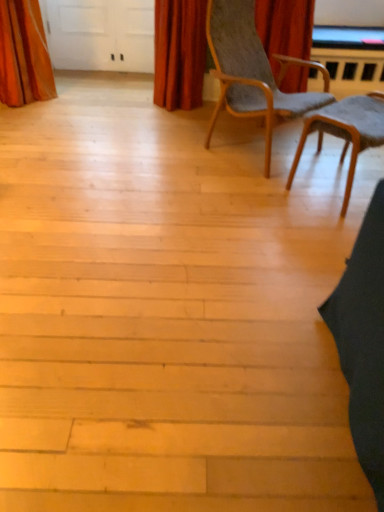
What do you see at coordinates (253, 71) in the screenshot? The width and height of the screenshot is (384, 512). I see `light brown wood chair at center, marked as the first chair in a left-to-right arrangement` at bounding box center [253, 71].

The width and height of the screenshot is (384, 512). I want to click on wooden textured chair at center right, which is the 1th chair from right to left, so click(345, 131).

The height and width of the screenshot is (512, 384). Identify the location of orange velvet curtain at upper left, which appears as the 1th curtain when viewed from the left. (24, 54).

What do you see at coordinates (179, 53) in the screenshot? The width and height of the screenshot is (384, 512). I see `velvet red curtain at upper center, the 1th curtain when ordered from right to left` at bounding box center [179, 53].

Identify the location of light brown wood chair at center, marked as the first chair in a left-to-right arrangement. (253, 71).

Looking at this image, does velvet red curtain at upper center, the 1th curtain when ordered from right to left, have a greater height compared to wooden textured chair at center right, which is the 1th chair from right to left?

Correct, velvet red curtain at upper center, the 1th curtain when ordered from right to left, is much taller as wooden textured chair at center right, which is the 1th chair from right to left.

From the image's perspective, is velvet red curtain at upper center, the 2th curtain from the left, located above or below wooden textured chair at center right, which is the 1th chair from right to left?

Clearly, from the image's perspective, velvet red curtain at upper center, the 2th curtain from the left, is above wooden textured chair at center right, which is the 1th chair from right to left.

Is velvet red curtain at upper center, the 1th curtain when ordered from right to left, placed right next to wooden textured chair at center right, which is the 1th chair from right to left?

No, velvet red curtain at upper center, the 1th curtain when ordered from right to left, is not with wooden textured chair at center right, which is the 1th chair from right to left.

Is the depth of wooden textured chair at center right, which is the 1th chair from right to left, greater than that of velvet red curtain at upper center, the 2th curtain from the left?

No, the depth of wooden textured chair at center right, which is the 1th chair from right to left, is less than that of velvet red curtain at upper center, the 2th curtain from the left.

Is point (320, 130) more distant than point (201, 10)?

No, it is in front of (201, 10).

From the image's perspective, is wooden textured chair at center right, the second chair from the left, positioned above or below velvet red curtain at upper center, the 2th curtain from the left?

From the image's perspective, wooden textured chair at center right, the second chair from the left, appears below velvet red curtain at upper center, the 2th curtain from the left.

Does orange velvet curtain at upper left, which appears as the 1th curtain when viewed from the left, appear on the right side of light brown wood chair at center, the 2th chair positioned from the right?

No.

Between orange velvet curtain at upper left, the 2th curtain in the right-to-left sequence, and light brown wood chair at center, the 2th chair positioned from the right, which one has less height?

Standing shorter between the two is orange velvet curtain at upper left, the 2th curtain in the right-to-left sequence.

Considering the relative positions of orange velvet curtain at upper left, which appears as the 1th curtain when viewed from the left, and light brown wood chair at center, the 2th chair positioned from the right, in the image provided, is orange velvet curtain at upper left, which appears as the 1th curtain when viewed from the left, behind light brown wood chair at center, the 2th chair positioned from the right,?

Yes.

This screenshot has width=384, height=512. I want to click on chair that is the 1st object to the right of the orange velvet curtain at upper left, the 2th curtain in the right-to-left sequence, starting at the anchor, so click(253, 71).

Is light brown wood chair at center, the 2th chair positioned from the right, to the right of orange velvet curtain at upper left, the 2th curtain in the right-to-left sequence, from the viewer's perspective?

Yes, light brown wood chair at center, the 2th chair positioned from the right, is to the right of orange velvet curtain at upper left, the 2th curtain in the right-to-left sequence.

Who is taller, light brown wood chair at center, the 2th chair positioned from the right, or orange velvet curtain at upper left, which appears as the 1th curtain when viewed from the left?

With more height is light brown wood chair at center, the 2th chair positioned from the right.

The height and width of the screenshot is (512, 384). There is a light brown wood chair at center, marked as the first chair in a left-to-right arrangement. What are the coordinates of `the 2nd curtain below it (from a real-world perspective)` in the screenshot? It's located at (24, 54).

Relative to orange velvet curtain at upper left, which appears as the 1th curtain when viewed from the left, is light brown wood chair at center, the 2th chair positioned from the right, in front or behind?

Clearly, light brown wood chair at center, the 2th chair positioned from the right, is in front of orange velvet curtain at upper left, which appears as the 1th curtain when viewed from the left.

Relative to wooden textured chair at center right, which is the 1th chair from right to left, is orange velvet curtain at upper left, which appears as the 1th curtain when viewed from the left, in front or behind?

In the image, orange velvet curtain at upper left, which appears as the 1th curtain when viewed from the left, appears behind wooden textured chair at center right, which is the 1th chair from right to left.

Looking at this image, from the image's perspective, which one is positioned lower, orange velvet curtain at upper left, the 2th curtain in the right-to-left sequence, or wooden textured chair at center right, which is the 1th chair from right to left?

wooden textured chair at center right, which is the 1th chair from right to left, appears lower in the image.

Is point (1, 30) positioned before point (330, 121)?

No, it is behind (330, 121).

Can you confirm if orange velvet curtain at upper left, the 2th curtain in the right-to-left sequence, is shorter than wooden textured chair at center right, which is the 1th chair from right to left?

No.

Does velvet red curtain at upper center, the 2th curtain from the left, turn towards light brown wood chair at center, the 2th chair positioned from the right?

No.

Where is `the 2nd curtain behind the light brown wood chair at center, marked as the first chair in a left-to-right arrangement`? The image size is (384, 512). the 2nd curtain behind the light brown wood chair at center, marked as the first chair in a left-to-right arrangement is located at coordinates (179, 53).

Would you say velvet red curtain at upper center, the 1th curtain when ordered from right to left, is inside or outside light brown wood chair at center, marked as the first chair in a left-to-right arrangement?

Result: The correct answer is: outside.

From a real-world perspective, which object rests below the other?

orange velvet curtain at upper left, the 2th curtain in the right-to-left sequence.

Which is more distant, (196, 76) or (29, 69)?

Point (196, 76)

Is velvet red curtain at upper center, the 1th curtain when ordered from right to left, to the left or to the right of orange velvet curtain at upper left, the 2th curtain in the right-to-left sequence, in the image?

In the image, velvet red curtain at upper center, the 1th curtain when ordered from right to left, appears on the right side of orange velvet curtain at upper left, the 2th curtain in the right-to-left sequence.

Is velvet red curtain at upper center, the 1th curtain when ordered from right to left, in front of or behind orange velvet curtain at upper left, which appears as the 1th curtain when viewed from the left, in the image?

velvet red curtain at upper center, the 1th curtain when ordered from right to left, is positioned farther from the viewer than orange velvet curtain at upper left, which appears as the 1th curtain when viewed from the left.

There is a wooden textured chair at center right, which is the 1th chair from right to left. Where is `the 2nd curtain above it (from a real-world perspective)`? This screenshot has height=512, width=384. the 2nd curtain above it (from a real-world perspective) is located at coordinates (179, 53).

This screenshot has width=384, height=512. In order to click on the 2nd curtain behind the wooden textured chair at center right, which is the 1th chair from right to left in this screenshot , I will do `click(179, 53)`.

Estimate the real-world distances between objects in this image. Which object is closer to light brown wood chair at center, the 2th chair positioned from the right, velvet red curtain at upper center, the 1th curtain when ordered from right to left, or orange velvet curtain at upper left, the 2th curtain in the right-to-left sequence?

velvet red curtain at upper center, the 1th curtain when ordered from right to left.

Looking at this image, looking at the image, which one is located closer to wooden textured chair at center right, which is the 1th chair from right to left, light brown wood chair at center, marked as the first chair in a left-to-right arrangement, or velvet red curtain at upper center, the 2th curtain from the left?

light brown wood chair at center, marked as the first chair in a left-to-right arrangement, is closer to wooden textured chair at center right, which is the 1th chair from right to left.

When comparing their distances from light brown wood chair at center, marked as the first chair in a left-to-right arrangement, does wooden textured chair at center right, the second chair from the left, or orange velvet curtain at upper left, which appears as the 1th curtain when viewed from the left, seem closer?

wooden textured chair at center right, the second chair from the left, is positioned closer to the anchor light brown wood chair at center, marked as the first chair in a left-to-right arrangement.

Which object lies further to the anchor point orange velvet curtain at upper left, which appears as the 1th curtain when viewed from the left, wooden textured chair at center right, the second chair from the left, or velvet red curtain at upper center, the 1th curtain when ordered from right to left?

Based on the image, wooden textured chair at center right, the second chair from the left, appears to be further to orange velvet curtain at upper left, which appears as the 1th curtain when viewed from the left.

From the picture: When comparing their distances from light brown wood chair at center, marked as the first chair in a left-to-right arrangement, does velvet red curtain at upper center, the 2th curtain from the left, or wooden textured chair at center right, the second chair from the left, seem closer?

The object closer to light brown wood chair at center, marked as the first chair in a left-to-right arrangement, is wooden textured chair at center right, the second chair from the left.

Based on their spatial positions, is velvet red curtain at upper center, the 2th curtain from the left, or orange velvet curtain at upper left, which appears as the 1th curtain when viewed from the left, further from wooden textured chair at center right, the second chair from the left?

orange velvet curtain at upper left, which appears as the 1th curtain when viewed from the left, is further to wooden textured chair at center right, the second chair from the left.

Estimate the real-world distances between objects in this image. Which object is closer to light brown wood chair at center, marked as the first chair in a left-to-right arrangement, wooden textured chair at center right, which is the 1th chair from right to left, or velvet red curtain at upper center, the 1th curtain when ordered from right to left?

Based on the image, wooden textured chair at center right, which is the 1th chair from right to left, appears to be nearer to light brown wood chair at center, marked as the first chair in a left-to-right arrangement.

Estimate the real-world distances between objects in this image. Which object is closer to orange velvet curtain at upper left, which appears as the 1th curtain when viewed from the left, wooden textured chair at center right, which is the 1th chair from right to left, or light brown wood chair at center, the 2th chair positioned from the right?

light brown wood chair at center, the 2th chair positioned from the right, is closer to orange velvet curtain at upper left, which appears as the 1th curtain when viewed from the left.

This screenshot has width=384, height=512. I want to click on chair between light brown wood chair at center, the 2th chair positioned from the right, and velvet red curtain at upper center, the 2th curtain from the left, from front to back, so click(345, 131).

The image size is (384, 512). In order to click on chair situated between orange velvet curtain at upper left, which appears as the 1th curtain when viewed from the left, and wooden textured chair at center right, the second chair from the left, from left to right in this screenshot , I will do `click(253, 71)`.

The image size is (384, 512). Find the location of `curtain between orange velvet curtain at upper left, which appears as the 1th curtain when viewed from the left, and light brown wood chair at center, marked as the first chair in a left-to-right arrangement`. curtain between orange velvet curtain at upper left, which appears as the 1th curtain when viewed from the left, and light brown wood chair at center, marked as the first chair in a left-to-right arrangement is located at coordinates (179, 53).

In order to click on curtain located between orange velvet curtain at upper left, which appears as the 1th curtain when viewed from the left, and wooden textured chair at center right, the second chair from the left, in the left-right direction in this screenshot , I will do `click(179, 53)`.